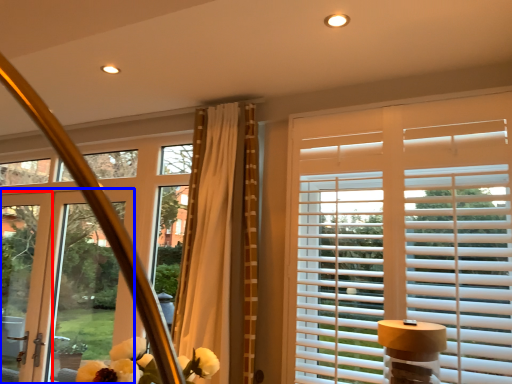
Question: Which point is further to the camera, screen door (highlighted by a red box) or door (highlighted by a blue box)?

Choices:
 (A) screen door
 (B) door

Answer: (A)